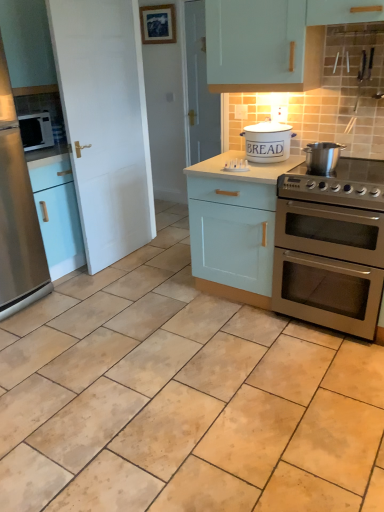
Question: Which direction should I rotate to look at white ceramic bread bin at center, the 1th appliance from the back?

Choices:
 (A) right
 (B) left

Answer: (A)

Question: Is white ceramic bread bin at center, the 1th appliance from the back, outside of stainless steel gas stove at right?

Choices:
 (A) no
 (B) yes

Answer: (B)

Question: Is white ceramic bread bin at center, the 2th appliance from the front, to the left of stainless steel gas stove at right from the viewer's perspective?

Choices:
 (A) yes
 (B) no

Answer: (A)

Question: Considering the relative positions of white ceramic bread bin at center, the 1th appliance from the back, and stainless steel gas stove at right in the image provided, is white ceramic bread bin at center, the 1th appliance from the back, behind stainless steel gas stove at right?

Choices:
 (A) no
 (B) yes

Answer: (B)

Question: Considering the relative sizes of white ceramic bread bin at center, the 2th appliance from the front, and stainless steel gas stove at right in the image provided, is white ceramic bread bin at center, the 2th appliance from the front, shorter than stainless steel gas stove at right?

Choices:
 (A) yes
 (B) no

Answer: (B)

Question: Considering the relative sizes of white ceramic bread bin at center, the 2th appliance from the front, and stainless steel gas stove at right in the image provided, is white ceramic bread bin at center, the 2th appliance from the front, wider than stainless steel gas stove at right?

Choices:
 (A) yes
 (B) no

Answer: (B)

Question: Considering the relative sizes of white ceramic bread bin at center, the 1th appliance from the back, and stainless steel gas stove at right in the image provided, is white ceramic bread bin at center, the 1th appliance from the back, thinner than stainless steel gas stove at right?

Choices:
 (A) yes
 (B) no

Answer: (A)

Question: Can you confirm if stainless steel refrigerator at left is positioned to the left of satin silver microwave at left?

Choices:
 (A) yes
 (B) no

Answer: (A)

Question: Is stainless steel refrigerator at left not close to satin silver microwave at left?

Choices:
 (A) yes
 (B) no

Answer: (B)

Question: Is stainless steel refrigerator at left next to satin silver microwave at left and touching it?

Choices:
 (A) no
 (B) yes

Answer: (A)

Question: Does stainless steel refrigerator at left have a greater height compared to satin silver microwave at left?

Choices:
 (A) no
 (B) yes

Answer: (B)

Question: Is stainless steel refrigerator at left to the right of satin silver microwave at left from the viewer's perspective?

Choices:
 (A) yes
 (B) no

Answer: (B)

Question: From a real-world perspective, does stainless steel refrigerator at left sit lower than satin silver microwave at left?

Choices:
 (A) yes
 (B) no

Answer: (A)

Question: Is stainless steel pot at upper right, which is counted as the 1th appliance, starting from the front, bigger than light blue wood cabinet at center?

Choices:
 (A) yes
 (B) no

Answer: (B)